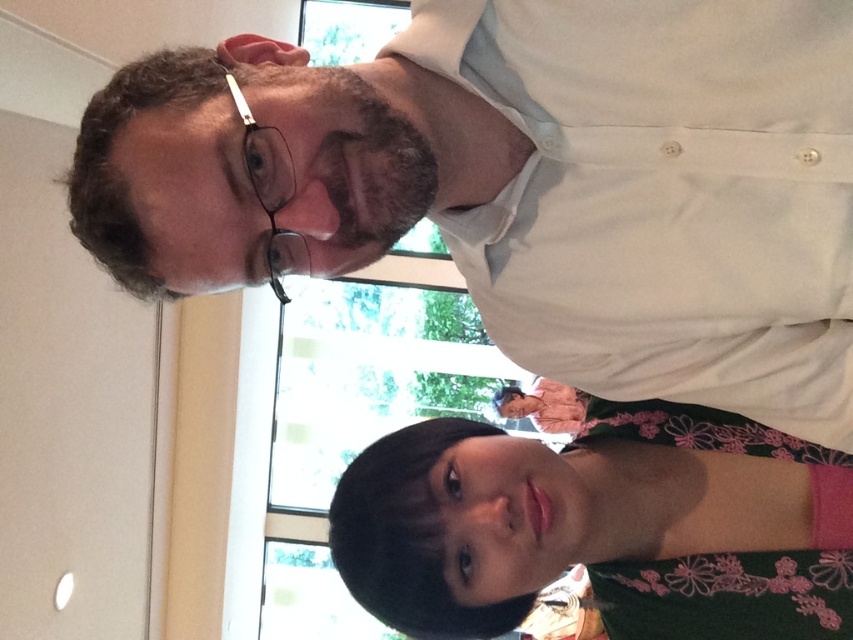
Question: Does white matte shirt at upper center come behind dark green floral dress at lower center?

Choices:
 (A) no
 (B) yes

Answer: (A)

Question: Based on their relative distances, which object is nearer to the white matte shirt at upper center?

Choices:
 (A) dark green floral dress at lower center
 (B) silver metallic glasses at upper left

Answer: (B)

Question: Can you confirm if dark green floral dress at lower center is wider than silver metallic glasses at upper left?

Choices:
 (A) no
 (B) yes

Answer: (B)

Question: Considering the real-world distances, which object is closest to the dark green floral dress at lower center?

Choices:
 (A) silver metallic glasses at upper left
 (B) white matte shirt at upper center

Answer: (B)

Question: Which point appears farthest from the camera in this image?

Choices:
 (A) (527, 141)
 (B) (273, 198)
 (C) (793, 520)

Answer: (C)

Question: Can you confirm if white matte shirt at upper center is positioned below dark green floral dress at lower center?

Choices:
 (A) yes
 (B) no

Answer: (B)